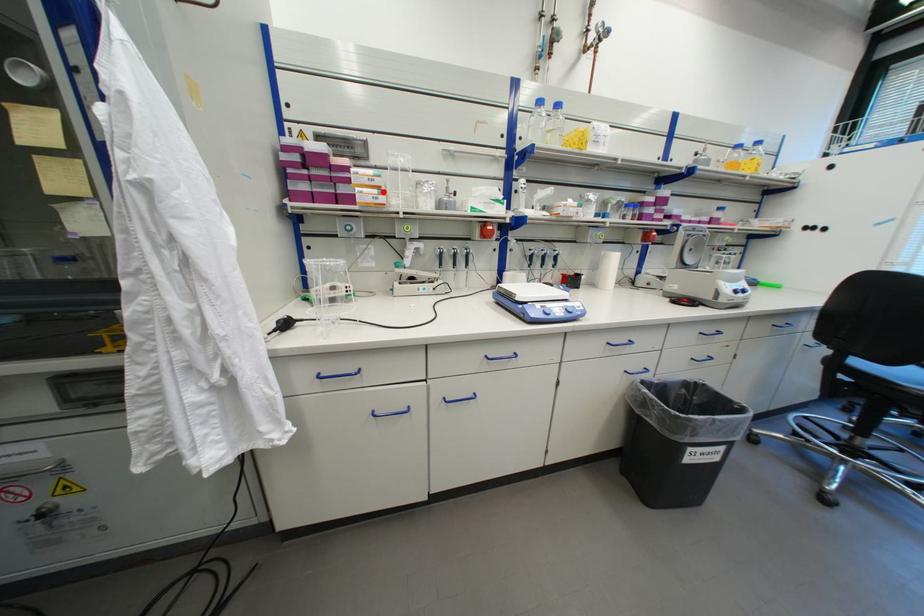
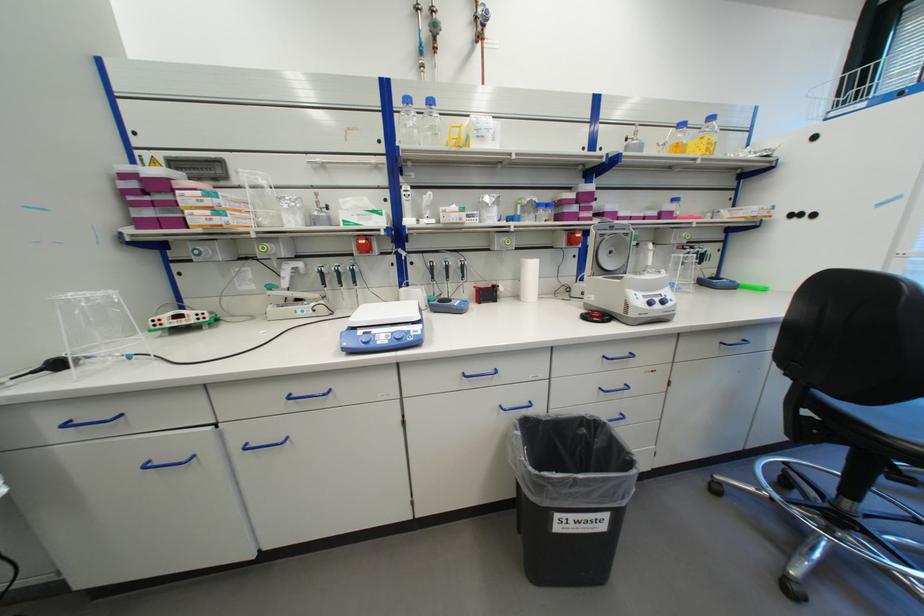
Question: I am providing you with two images of the same scene from different viewpoints. A red point is marked on the first image. Can you still see the location of the red point in image 2?

Choices:
 (A) Yes
 (B) No

Answer: (A)